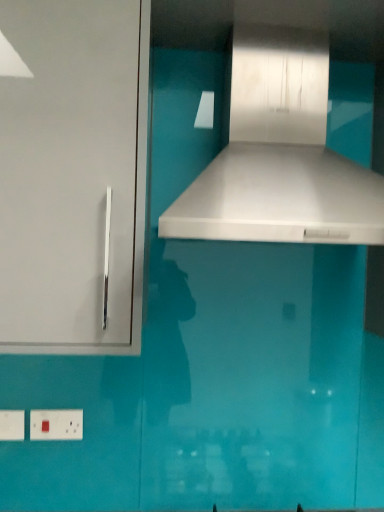
At what (x,y) coordinates should I click in order to perform the action: click on white plastic electric outlet at lower left, arranged as the second electric outlet when viewed from the right. Please return your answer as a coordinate pair (x, y). Looking at the image, I should click on coord(12,425).

This screenshot has width=384, height=512. Find the location of `white plastic electric outlet at lower left, the second electric outlet in the left-to-right sequence`. white plastic electric outlet at lower left, the second electric outlet in the left-to-right sequence is located at coordinates (56, 424).

From the picture: What is the approximate height of white glossy vent at center?

white glossy vent at center is 21.38 inches tall.

In order to click on white plastic electric outlet at lower left, arranged as the second electric outlet when viewed from the right in this screenshot , I will do `click(12, 425)`.

Is white glossy vent at center at the back of white plastic electric outlet at lower left, the first electric outlet from the right?

No.

Is white plastic electric outlet at lower left, the second electric outlet in the left-to-right sequence, outside of white glossy vent at center?

Indeed, white plastic electric outlet at lower left, the second electric outlet in the left-to-right sequence, is completely outside white glossy vent at center.

From the image's perspective, would you say white plastic electric outlet at lower left, the first electric outlet from the right, is shown under white glossy vent at center?

Yes, from the image's perspective, white plastic electric outlet at lower left, the first electric outlet from the right, is beneath white glossy vent at center.

Is white plastic electric outlet at lower left, the second electric outlet in the left-to-right sequence, not close to white glossy vent at center?

white plastic electric outlet at lower left, the second electric outlet in the left-to-right sequence, is near white glossy vent at center, not far away.

From a real-world perspective, is white plastic electric outlet at lower left, the first electric outlet from the right, positioned over white plastic electric outlet at lower left, arranged as the second electric outlet when viewed from the right, based on gravity?

Yes.

Based on the photo, is white plastic electric outlet at lower left, the first electric outlet from the right, wider than white plastic electric outlet at lower left, arranged as the second electric outlet when viewed from the right?

Correct, the width of white plastic electric outlet at lower left, the first electric outlet from the right, exceeds that of white plastic electric outlet at lower left, arranged as the second electric outlet when viewed from the right.

Does white plastic electric outlet at lower left, the first electric outlet from the right, have a greater height compared to white plastic electric outlet at lower left, the first electric outlet viewed from the left?

Indeed, white plastic electric outlet at lower left, the first electric outlet from the right, has a greater height compared to white plastic electric outlet at lower left, the first electric outlet viewed from the left.

Could you measure the distance between white plastic electric outlet at lower left, the first electric outlet from the right, and white plastic electric outlet at lower left, the first electric outlet viewed from the left?

white plastic electric outlet at lower left, the first electric outlet from the right, is 3.12 inches from white plastic electric outlet at lower left, the first electric outlet viewed from the left.

What's the angular difference between white plastic electric outlet at lower left, the first electric outlet viewed from the left, and white plastic electric outlet at lower left, the first electric outlet from the right,'s facing directions?

0.639 degrees.

Based on their positions, is white plastic electric outlet at lower left, the first electric outlet viewed from the left, located to the left or right of white plastic electric outlet at lower left, the first electric outlet from the right?

white plastic electric outlet at lower left, the first electric outlet viewed from the left, is to the left of white plastic electric outlet at lower left, the first electric outlet from the right.

Are white plastic electric outlet at lower left, arranged as the second electric outlet when viewed from the right, and white plastic electric outlet at lower left, the first electric outlet from the right, far apart?

Actually, white plastic electric outlet at lower left, arranged as the second electric outlet when viewed from the right, and white plastic electric outlet at lower left, the first electric outlet from the right, are a little close together.

Could white plastic electric outlet at lower left, the second electric outlet in the left-to-right sequence, be considered to be inside white plastic electric outlet at lower left, arranged as the second electric outlet when viewed from the right?

No, white plastic electric outlet at lower left, the second electric outlet in the left-to-right sequence, is not surrounded by white plastic electric outlet at lower left, arranged as the second electric outlet when viewed from the right.

Could you tell me if white plastic electric outlet at lower left, the first electric outlet viewed from the left, is facing white glossy cabinet handle at left?

No.

Is point (8, 428) positioned after point (80, 292)?

Yes, it is behind point (80, 292).

From a real-world perspective, is white plastic electric outlet at lower left, the first electric outlet viewed from the left, located higher than white glossy cabinet handle at left?

Actually, white plastic electric outlet at lower left, the first electric outlet viewed from the left, is physically below white glossy cabinet handle at left in the real world.

Relative to white glossy cabinet handle at left, is white plastic electric outlet at lower left, arranged as the second electric outlet when viewed from the right, in front or behind?

Clearly, white plastic electric outlet at lower left, arranged as the second electric outlet when viewed from the right, is behind white glossy cabinet handle at left.

Does white glossy vent at center have a lesser height compared to white plastic electric outlet at lower left, the first electric outlet from the right?

Incorrect, the height of white glossy vent at center does not fall short of that of white plastic electric outlet at lower left, the first electric outlet from the right.

Considering the sizes of white glossy vent at center and white plastic electric outlet at lower left, the second electric outlet in the left-to-right sequence, in the image, is white glossy vent at center wider or thinner than white plastic electric outlet at lower left, the second electric outlet in the left-to-right sequence,?

white glossy vent at center is wider than white plastic electric outlet at lower left, the second electric outlet in the left-to-right sequence.

Can you confirm if white glossy vent at center is bigger than white plastic electric outlet at lower left, the first electric outlet from the right?

Indeed, white glossy vent at center has a larger size compared to white plastic electric outlet at lower left, the first electric outlet from the right.

In the scene shown: How many degrees apart are the facing directions of white glossy vent at center and white plastic electric outlet at lower left, the first electric outlet from the right?

The angle between the facing direction of white glossy vent at center and the facing direction of white plastic electric outlet at lower left, the first electric outlet from the right, is 0.554 degrees.

Is white glossy cabinet handle at left at the back of white plastic electric outlet at lower left, the second electric outlet in the left-to-right sequence?

white plastic electric outlet at lower left, the second electric outlet in the left-to-right sequence, does not have its back to white glossy cabinet handle at left.

Which is in front, white plastic electric outlet at lower left, the second electric outlet in the left-to-right sequence, or white glossy cabinet handle at left?

white glossy cabinet handle at left.

Is point (66, 433) in front of point (79, 88)?

No, it is behind (79, 88).

Based on the photo, can you confirm if white plastic electric outlet at lower left, the first electric outlet from the right, is positioned to the left of white glossy cabinet handle at left?

Yes, white plastic electric outlet at lower left, the first electric outlet from the right, is to the left of white glossy cabinet handle at left.

Is white glossy vent at center in contact with white glossy cabinet handle at left?

No, white glossy vent at center is not in contact with white glossy cabinet handle at left.

You are a GUI agent. You are given a task and a screenshot of the screen. Output one action in this format:
    pyautogui.click(x=<x>, y=<y>)
    Task: Click on the vent positioned vertically above the white glossy cabinet handle at left (from a real-world perspective)
    The image size is (384, 512).
    Given the screenshot: What is the action you would take?
    pyautogui.click(x=279, y=155)

Could you tell me if white glossy vent at center is turned towards white glossy cabinet handle at left?

No, white glossy vent at center is not facing towards white glossy cabinet handle at left.

How different are the orientations of white glossy vent at center and white glossy cabinet handle at left in degrees?

0.219 degrees.

I want to click on vent in front of the white plastic electric outlet at lower left, the second electric outlet in the left-to-right sequence, so click(x=279, y=155).

At what (x,y) coordinates should I click in order to perform the action: click on electric outlet located above the white plastic electric outlet at lower left, the first electric outlet from the right (from the image's perspective). Please return your answer as a coordinate pair (x, y). Looking at the image, I should click on (12, 425).

From the picture: Estimate the real-world distances between objects in this image. Which object is further from white plastic electric outlet at lower left, the second electric outlet in the left-to-right sequence, white glossy vent at center or white plastic electric outlet at lower left, arranged as the second electric outlet when viewed from the right?

The object further to white plastic electric outlet at lower left, the second electric outlet in the left-to-right sequence, is white glossy vent at center.

Estimate the real-world distances between objects in this image. Which object is closer to white plastic electric outlet at lower left, the second electric outlet in the left-to-right sequence, white glossy cabinet handle at left or white plastic electric outlet at lower left, the first electric outlet viewed from the left?

white plastic electric outlet at lower left, the first electric outlet viewed from the left, is closer to white plastic electric outlet at lower left, the second electric outlet in the left-to-right sequence.

From the image, which object appears to be farther from white glossy cabinet handle at left, white glossy vent at center or white plastic electric outlet at lower left, the first electric outlet from the right?

The object further to white glossy cabinet handle at left is white plastic electric outlet at lower left, the first electric outlet from the right.

When comparing their distances from white plastic electric outlet at lower left, the second electric outlet in the left-to-right sequence, does white plastic electric outlet at lower left, the first electric outlet viewed from the left, or white glossy vent at center seem further?

Based on the image, white glossy vent at center appears to be further to white plastic electric outlet at lower left, the second electric outlet in the left-to-right sequence.

Estimate the real-world distances between objects in this image. Which object is further from white glossy cabinet handle at left, white plastic electric outlet at lower left, arranged as the second electric outlet when viewed from the right, or white plastic electric outlet at lower left, the first electric outlet from the right?

Among the two, white plastic electric outlet at lower left, arranged as the second electric outlet when viewed from the right, is located further to white glossy cabinet handle at left.

Based on the photo, from the image, which object appears to be farther from white glossy vent at center, white plastic electric outlet at lower left, the first electric outlet from the right, or white plastic electric outlet at lower left, the first electric outlet viewed from the left?

Based on the image, white plastic electric outlet at lower left, the first electric outlet viewed from the left, appears to be further to white glossy vent at center.

When comparing their distances from white plastic electric outlet at lower left, arranged as the second electric outlet when viewed from the right, does white glossy vent at center or white glossy cabinet handle at left seem further?

white glossy vent at center lies further to white plastic electric outlet at lower left, arranged as the second electric outlet when viewed from the right, than the other object.

Estimate the real-world distances between objects in this image. Which object is further from white plastic electric outlet at lower left, the second electric outlet in the left-to-right sequence, white glossy cabinet handle at left or white glossy vent at center?

Among the two, white glossy vent at center is located further to white plastic electric outlet at lower left, the second electric outlet in the left-to-right sequence.

I want to click on electric outlet that lies between white glossy vent at center and white plastic electric outlet at lower left, the first electric outlet from the right, from top to bottom, so click(12, 425).

Where is `cabinetry between white glossy vent at center and white plastic electric outlet at lower left, the second electric outlet in the left-to-right sequence, vertically`? This screenshot has width=384, height=512. cabinetry between white glossy vent at center and white plastic electric outlet at lower left, the second electric outlet in the left-to-right sequence, vertically is located at coordinates point(73,175).

Where is `electric outlet between white glossy cabinet handle at left and white plastic electric outlet at lower left, the first electric outlet from the right, from top to bottom`? The image size is (384, 512). electric outlet between white glossy cabinet handle at left and white plastic electric outlet at lower left, the first electric outlet from the right, from top to bottom is located at coordinates (12, 425).

Find the location of a particular element. cabinetry between white glossy vent at center and white plastic electric outlet at lower left, the first electric outlet viewed from the left, vertically is located at coordinates [73, 175].